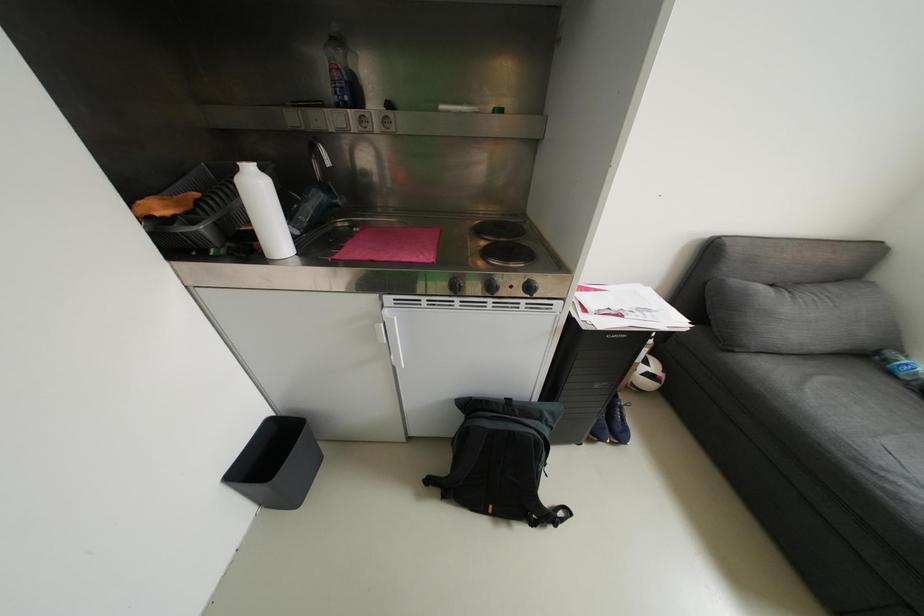
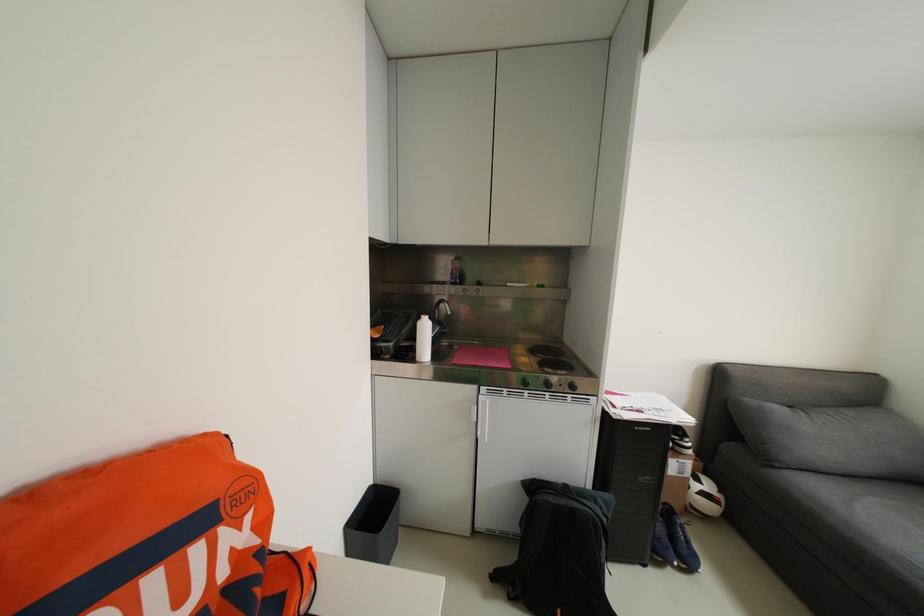
Question: The images are taken continuously from a first-person perspective. In which direction is your viewpoint rotating?

Choices:
 (A) Left
 (B) Right
 (C) Up
 (D) Down

Answer: (C)